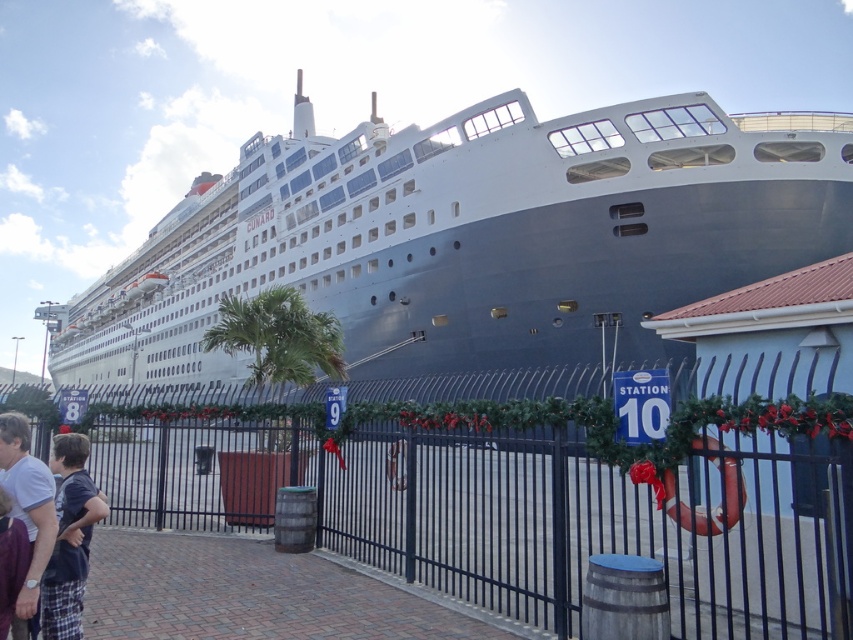
You are standing at the port and see the black metal fence at center and the dark blue cotton shirt at lower left. Which object is located to the right of the other?

The black metal fence at center is positioned on the right side of dark blue cotton shirt at lower left, so the black metal fence at center is to the right of the dark blue cotton shirt at lower left.

You are standing at the port and see the white glossy cruise ship at center and the dark blue cotton shirt at lower left. Which object is positioned higher in the image?

The white glossy cruise ship at center is above the dark blue cotton shirt at lower left, so it is positioned higher in the image.